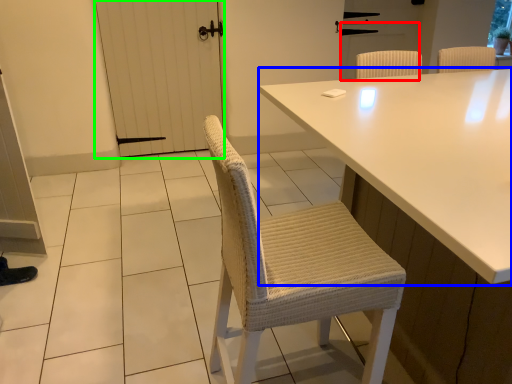
Question: Estimate the real-world distances between objects in this image. Which object is farther from screen door (highlighted by a red box), table (highlighted by a blue box) or screen door (highlighted by a green box)?

Choices:
 (A) table
 (B) screen door

Answer: (A)